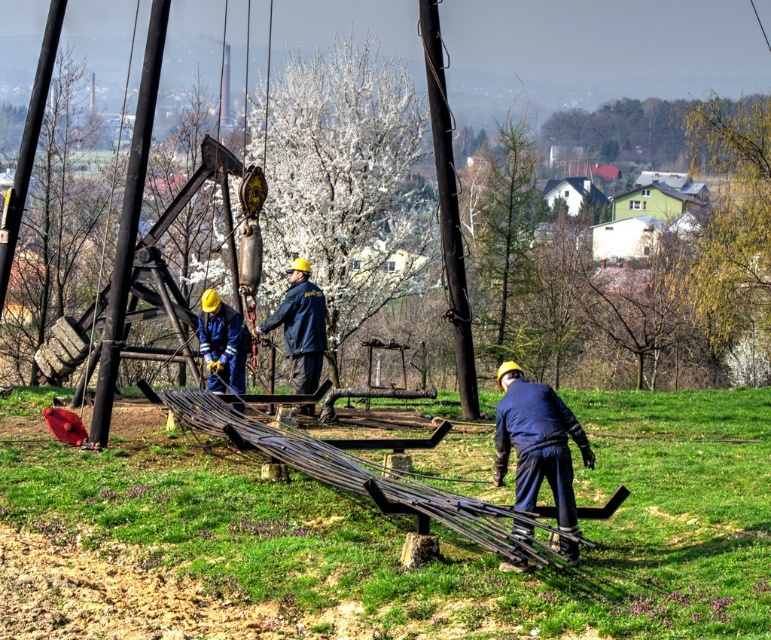
Which of these two, blue fabric worker at lower right or blue fabric jacket at center, stands shorter?

blue fabric worker at lower right is shorter.

Which is behind, point (530, 429) or point (302, 348)?

Positioned behind is point (302, 348).

Identify the location of blue fabric worker at lower right. This screenshot has width=771, height=640. (537, 442).

Between blue fabric jacket at center and blue fabric worker at center, which one appears on the left side from the viewer's perspective?

From the viewer's perspective, blue fabric worker at center appears more on the left side.

The width and height of the screenshot is (771, 640). Identify the location of blue fabric jacket at center. (300, 326).

Is blue fabric worker at lower right further to the viewer compared to blue fabric worker at center?

No, blue fabric worker at lower right is closer to the viewer.

How far apart are blue fabric worker at lower right and blue fabric worker at center?

blue fabric worker at lower right is 9.36 meters from blue fabric worker at center.

The image size is (771, 640). Identify the location of blue fabric worker at lower right. point(537,442).

I want to click on blue fabric worker at lower right, so click(537, 442).